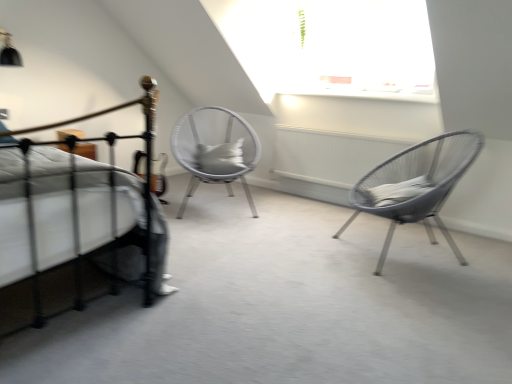
Question: Is white woven chair at center, acting as the 2th chair starting from the front, far from metallic wire chair at right, the first chair in the front-to-back sequence?

Choices:
 (A) no
 (B) yes

Answer: (B)

Question: From a real-world perspective, is white woven chair at center, the first chair from the back, under metallic wire chair at right, the first chair in the front-to-back sequence?

Choices:
 (A) no
 (B) yes

Answer: (A)

Question: From the image's perspective, does white woven chair at center, positioned as the first chair in left-to-right order, appear lower than metallic wire chair at right, which is counted as the second chair, starting from the left?

Choices:
 (A) no
 (B) yes

Answer: (A)

Question: Is white woven chair at center, positioned as the first chair in left-to-right order, facing towards metallic wire chair at right, arranged as the first chair when viewed from the right?

Choices:
 (A) no
 (B) yes

Answer: (A)

Question: Is white woven chair at center, the 2th chair positioned from the right, placed right next to metallic wire chair at right, the first chair in the front-to-back sequence?

Choices:
 (A) yes
 (B) no

Answer: (B)

Question: From a real-world perspective, is metallic wire chair at right, the 2th chair in the back-to-front sequence, above or below black metal bed at left?

Choices:
 (A) above
 (B) below

Answer: (A)

Question: Based on their positions, is metallic wire chair at right, the first chair in the front-to-back sequence, located to the left or right of black metal bed at left?

Choices:
 (A) right
 (B) left

Answer: (A)

Question: Relative to black metal bed at left, is metallic wire chair at right, the 2th chair in the back-to-front sequence, in front or behind?

Choices:
 (A) behind
 (B) front

Answer: (A)

Question: In terms of size, does metallic wire chair at right, which is counted as the second chair, starting from the left, appear bigger or smaller than black metal bed at left?

Choices:
 (A) big
 (B) small

Answer: (B)

Question: Looking at the image, does white woven chair at center, the first chair from the back, seem bigger or smaller compared to gray fabric pillow at center?

Choices:
 (A) small
 (B) big

Answer: (B)

Question: From a real-world perspective, is white woven chair at center, positioned as the first chair in left-to-right order, physically located above or below gray fabric pillow at center?

Choices:
 (A) above
 (B) below

Answer: (B)

Question: Relative to gray fabric pillow at center, is white woven chair at center, positioned as the first chair in left-to-right order, in front or behind?

Choices:
 (A) behind
 (B) front

Answer: (B)

Question: Is point (221, 175) closer or farther from the camera than point (215, 145)?

Choices:
 (A) farther
 (B) closer

Answer: (B)

Question: From the image's perspective, is gray fabric pillow at center positioned above or below black metal bed at left?

Choices:
 (A) below
 (B) above

Answer: (B)

Question: Considering the positions of gray fabric pillow at center and black metal bed at left in the image, is gray fabric pillow at center taller or shorter than black metal bed at left?

Choices:
 (A) tall
 (B) short

Answer: (B)